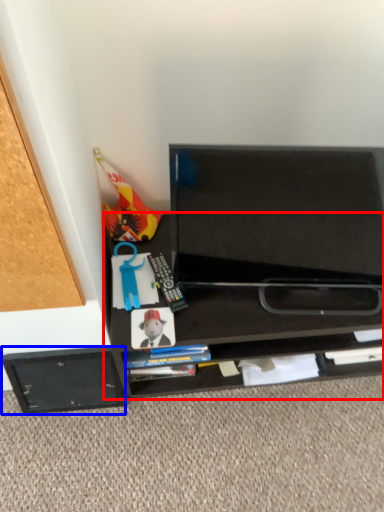
Question: Which point is closer to the camera, desk (highlighted by a red box) or drawer (highlighted by a blue box)?

Choices:
 (A) desk
 (B) drawer

Answer: (A)